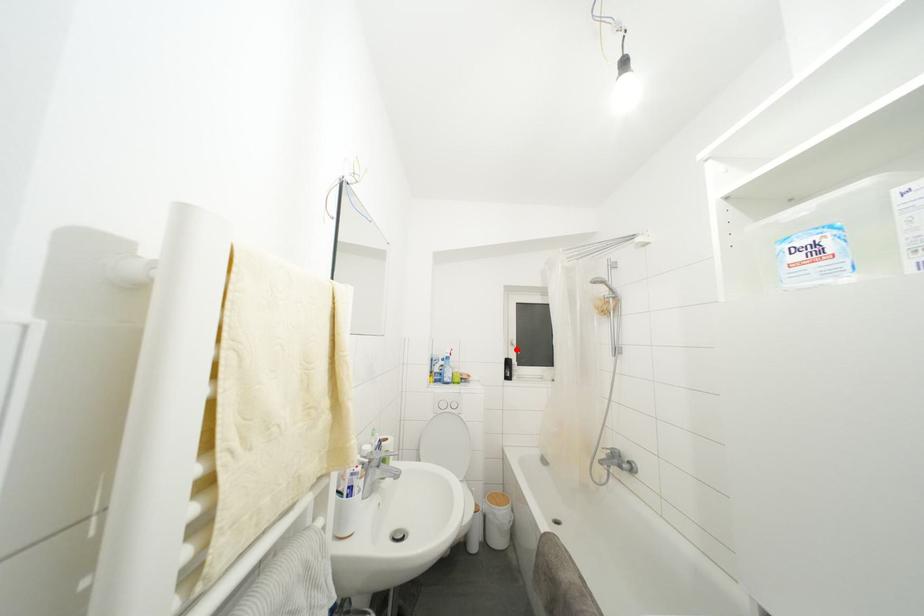
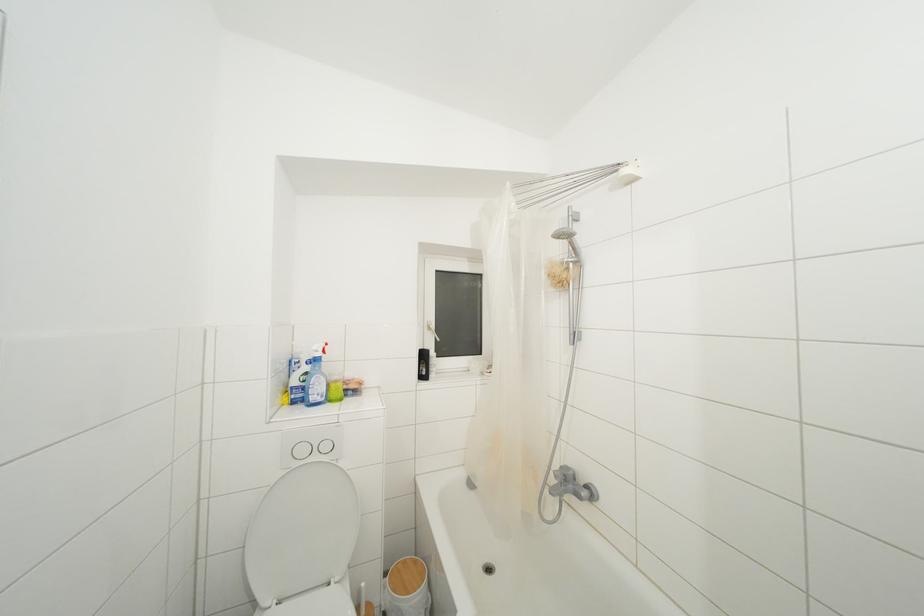
In the second image, find the point that corresponds to the highlighted location in the first image.

(433, 333)